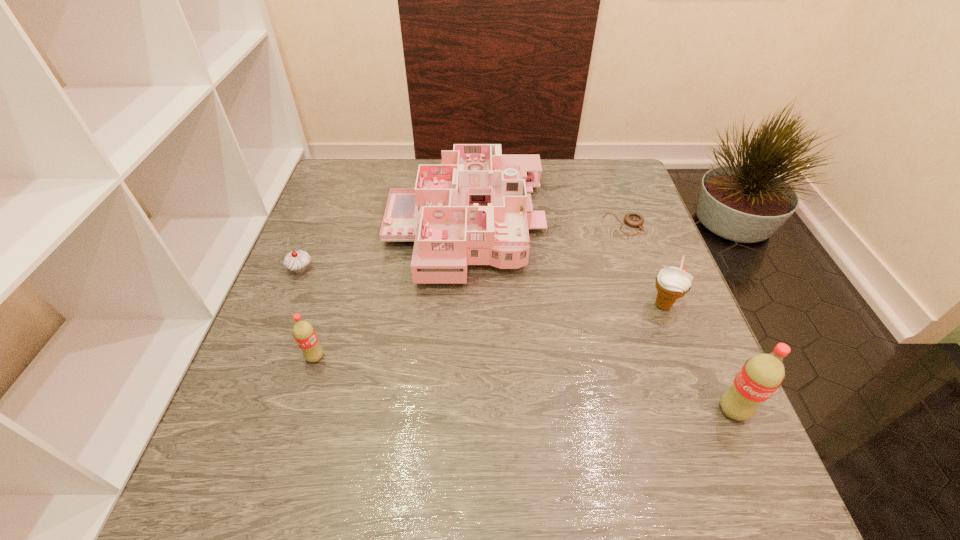
Identify the location of the farther soda. Image resolution: width=960 pixels, height=540 pixels. (304, 333).

Image resolution: width=960 pixels, height=540 pixels. What are the coordinates of `the left soda` in the screenshot? It's located at (304, 333).

Find the location of a particular element. This screenshot has height=540, width=960. the nearest object is located at coordinates (761, 375).

Identify the location of the taller soda. (761, 375).

I want to click on the fourth object from right to left, so click(473, 209).

This screenshot has width=960, height=540. I want to click on pocket watch, so click(x=632, y=219).

What are the coordinates of `the third nearest object` in the screenshot? It's located at (672, 283).

Where is `the leftmost object`? the leftmost object is located at coordinates (297, 261).

This screenshot has width=960, height=540. In order to click on the fifth tallest object in this screenshot , I will do coord(297,261).

Find the location of a particular element. Image resolution: width=960 pixels, height=540 pixels. free location located on the right of the farther soda is located at coordinates (385, 357).